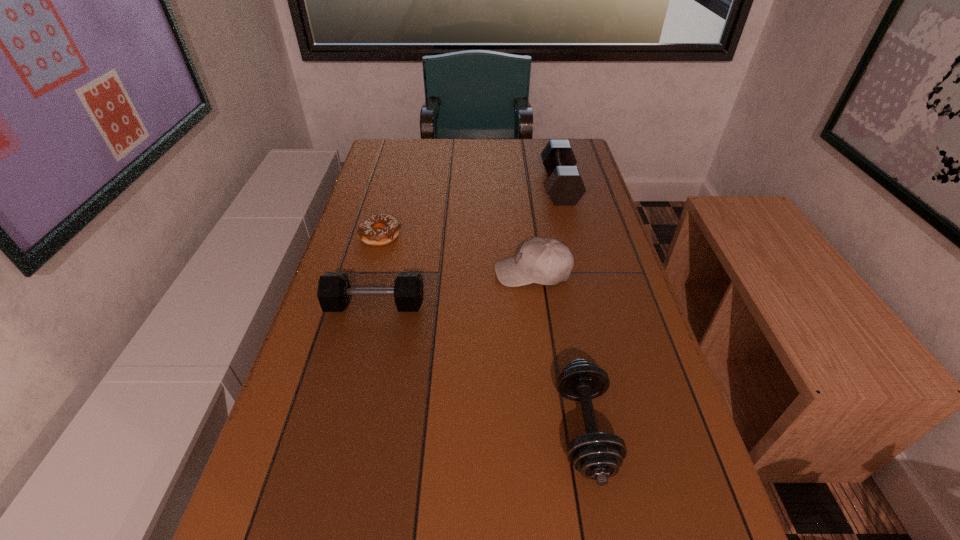
Find the location of `vacant region between the second farthest object and the third nearest object`. vacant region between the second farthest object and the third nearest object is located at coordinates (457, 254).

At what (x,y) coordinates should I click in order to perform the action: click on vacant space in between the shortest object and the farthest dumbbell. Please return your answer as a coordinate pair (x, y). Image resolution: width=960 pixels, height=540 pixels. Looking at the image, I should click on (470, 211).

This screenshot has height=540, width=960. I want to click on vacant area that lies between the nearest object and the farthest dumbbell, so click(x=572, y=308).

This screenshot has height=540, width=960. Find the location of `the third closest object to the farthest dumbbell`. the third closest object to the farthest dumbbell is located at coordinates (334, 290).

The width and height of the screenshot is (960, 540). Find the location of `object that is the fourth nearest to the fourth nearest object`. object that is the fourth nearest to the fourth nearest object is located at coordinates (598, 456).

Locate an element on the screen. This screenshot has width=960, height=540. dumbbell that stands as the third closest to the doughnut is located at coordinates (598, 456).

I want to click on the third closest dumbbell to the second farthest object, so click(x=598, y=456).

The image size is (960, 540). I want to click on free space that satisfies the following two spatial constraints: 1. on the front side of the farthest object; 2. on the front-facing side of the third farthest object, so click(x=582, y=272).

Locate an element on the screen. The width and height of the screenshot is (960, 540). vacant space that satisfies the following two spatial constraints: 1. on the back side of the fourth nearest object; 2. on the left side of the farthest object is located at coordinates (394, 186).